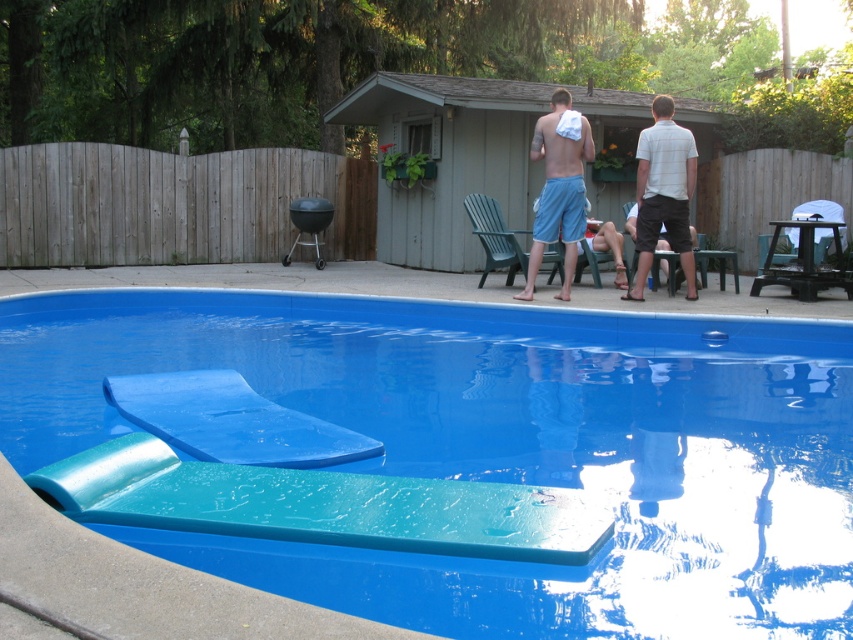
Question: Can you confirm if blue rubber pool float at lower center is positioned to the left of blue plastic slide at lower center?

Choices:
 (A) no
 (B) yes

Answer: (B)

Question: Which of the following is the closest to the observer?

Choices:
 (A) blue rubber pool float at lower center
 (B) blue plastic slide at lower center

Answer: (B)

Question: Can you confirm if blue rubber pool float at lower center is positioned below matte blue shorts at upper center?

Choices:
 (A) no
 (B) yes

Answer: (B)

Question: Which point is closer to the camera taking this photo?

Choices:
 (A) (247, 406)
 (B) (579, 147)
 (C) (663, 120)

Answer: (A)

Question: Based on their relative distances, which object is farther from the matte blue shorts at upper center?

Choices:
 (A) blue cotton shorts at upper center
 (B) blue rubber pool float at lower center
 (C) white checkered shirt at upper right
 (D) blue plastic slide at lower center

Answer: (B)

Question: Is blue rubber pool float at lower center positioned before blue cotton shorts at upper center?

Choices:
 (A) no
 (B) yes

Answer: (B)